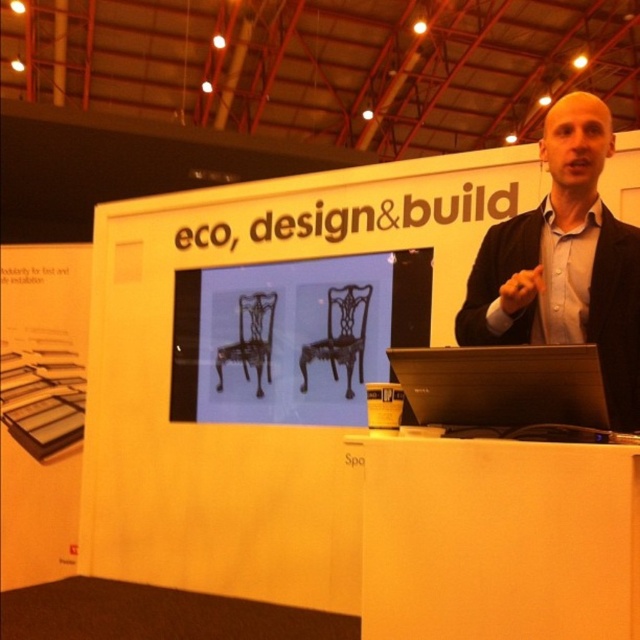
Question: Can you confirm if black wrought iron chairs at center is bigger than black matte laptop at center?

Choices:
 (A) yes
 (B) no

Answer: (A)

Question: Which object is the farthest from the black wrought iron chairs at center?

Choices:
 (A) black matte laptop at center
 (B) black suit at upper right

Answer: (A)

Question: Is black wrought iron chairs at center thinner than black suit at upper right?

Choices:
 (A) yes
 (B) no

Answer: (B)

Question: Which of the following is the farthest from the observer?

Choices:
 (A) (524, 404)
 (B) (212, 358)
 (C) (508, 269)

Answer: (B)

Question: Estimate the real-world distances between objects in this image. Which object is closer to the black wrought iron chairs at center?

Choices:
 (A) black suit at upper right
 (B) black matte laptop at center

Answer: (A)

Question: Can you confirm if black suit at upper right is bigger than black matte laptop at center?

Choices:
 (A) yes
 (B) no

Answer: (A)